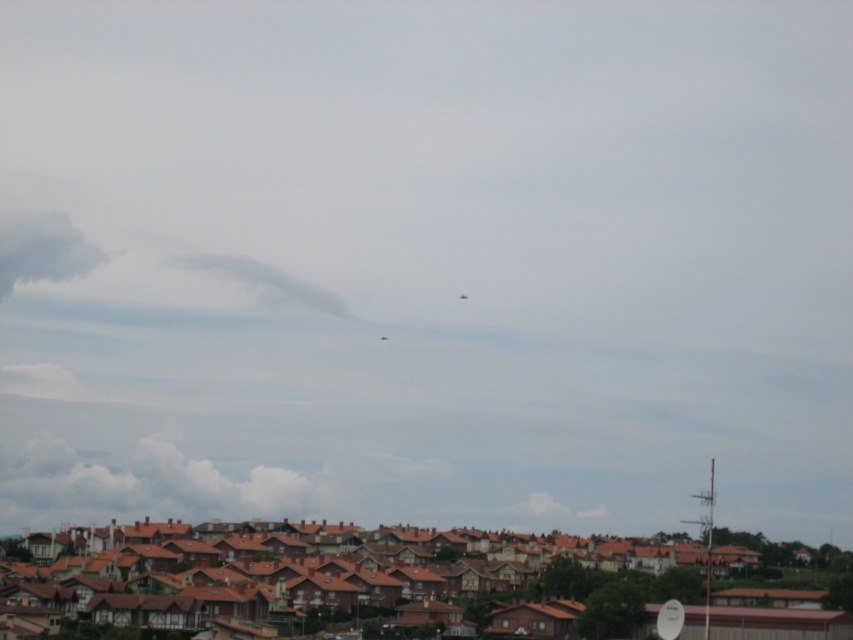
You are looking at the residential area under a cloudy sky. There are two white fluffy clouds in the scene. Which one, the white fluffy cloud at lower left or the white fluffy cloud at upper center, is taller?

The white fluffy cloud at lower left is taller than the white fluffy cloud at upper center.